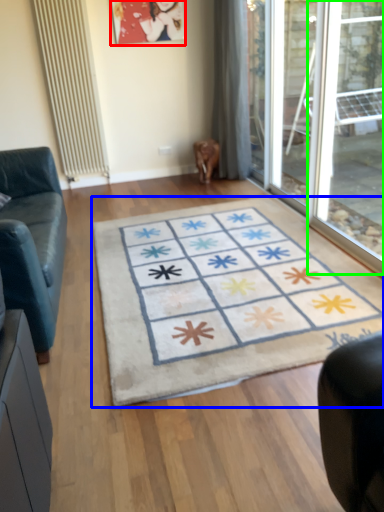
Question: Which object is positioned closest to picture frame (highlighted by a red box)? Select from doormat (highlighted by a blue box) and window (highlighted by a green box).

Choices:
 (A) doormat
 (B) window

Answer: (B)